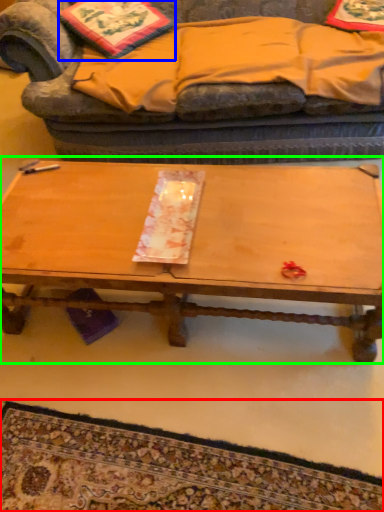
Question: Considering the real-world distances, which object is closest to mat (highlighted by a red box)? pillow (highlighted by a blue box) or coffee table (highlighted by a green box).

Choices:
 (A) pillow
 (B) coffee table

Answer: (B)